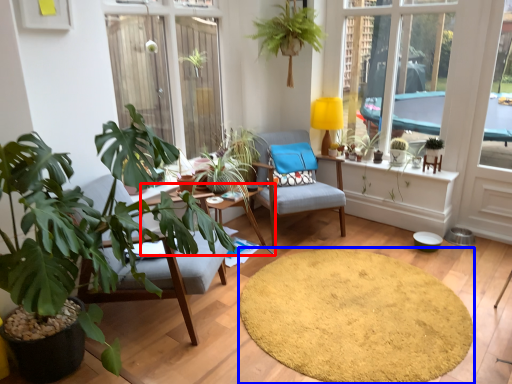
Question: Among these objects, which one is nearest to the camera, table (highlighted by a red box) or mat (highlighted by a blue box)?

Choices:
 (A) table
 (B) mat

Answer: (B)